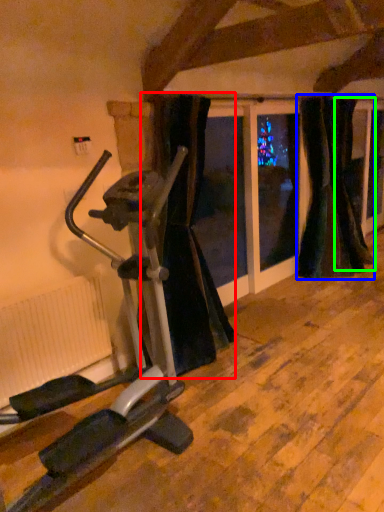
Question: Which object is positioned closest to curtain (highlighted by a red box)? Select from curtain (highlighted by a blue box) and curtain (highlighted by a green box).

Choices:
 (A) curtain
 (B) curtain

Answer: (A)